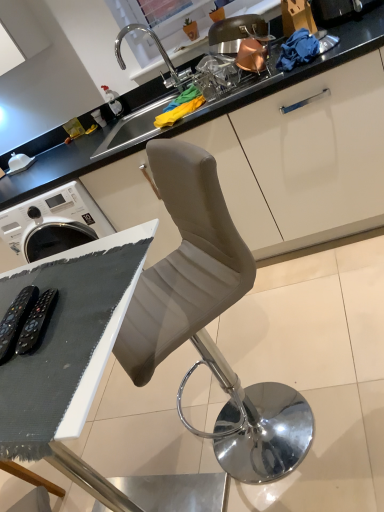
This screenshot has height=512, width=384. I want to click on free space above suede-like gray chair at center (from a real-world perspective), so click(259, 342).